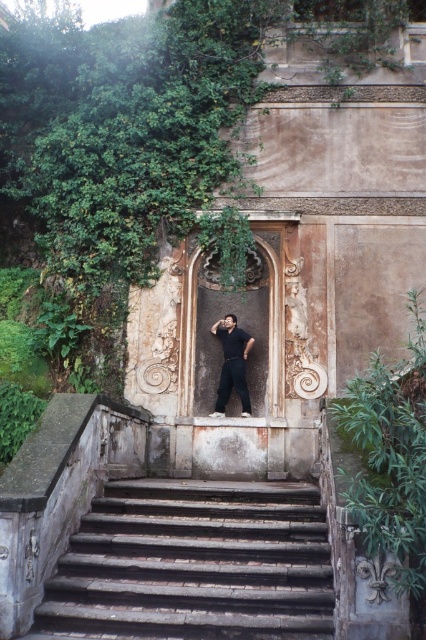
Does dark gray stone stairs at center have a larger size compared to dark gray cotton pants at center?

Indeed, dark gray stone stairs at center has a larger size compared to dark gray cotton pants at center.

Is the position of dark gray stone stairs at center more distant than that of dark gray cotton pants at center?

No, it is not.

This screenshot has height=640, width=426. Describe the element at coordinates (195, 564) in the screenshot. I see `dark gray stone stairs at center` at that location.

Identify the location of dark gray stone stairs at center. The image size is (426, 640). (195, 564).

Between rustic stone door at center and dark gray cotton pants at center, which one appears on the right side from the viewer's perspective?

From the viewer's perspective, rustic stone door at center appears more on the right side.

How far apart are rustic stone door at center and dark gray cotton pants at center?

rustic stone door at center and dark gray cotton pants at center are 84.38 centimeters apart.

Does point (186, 369) lie behind point (238, 392)?

No, it is in front of (238, 392).

I want to click on rustic stone door at center, so click(x=275, y=324).

Does green leafy ivy at lower right have a lesser height compared to rustic stone door at center?

Yes, green leafy ivy at lower right is shorter than rustic stone door at center.

Is point (425, 368) less distant than point (270, 365)?

Yes, point (425, 368) is closer to viewer.

Does point (420, 557) come behind point (189, 381)?

That is False.

Where is `green leafy ivy at lower right`? green leafy ivy at lower right is located at coordinates (391, 456).